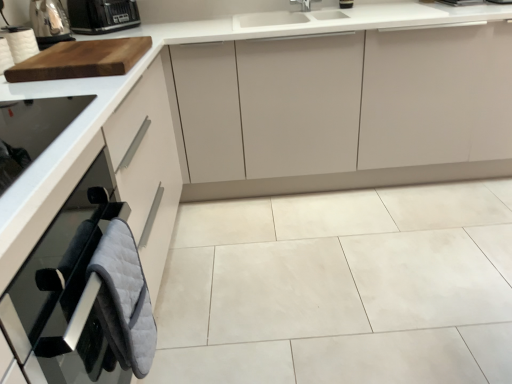
Identify the location of empty space that is ontop of black glass oven at left (from a real-world perspective). (30, 127).